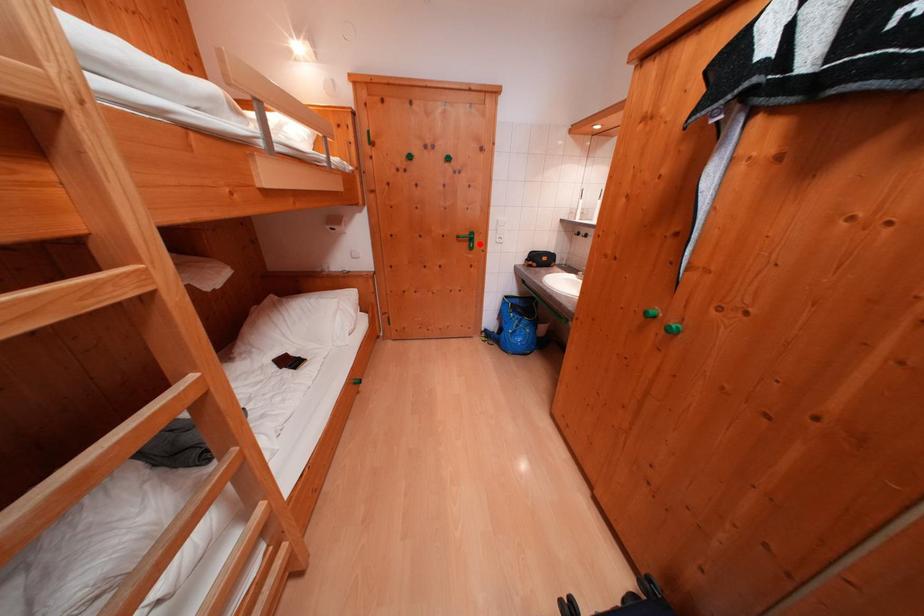
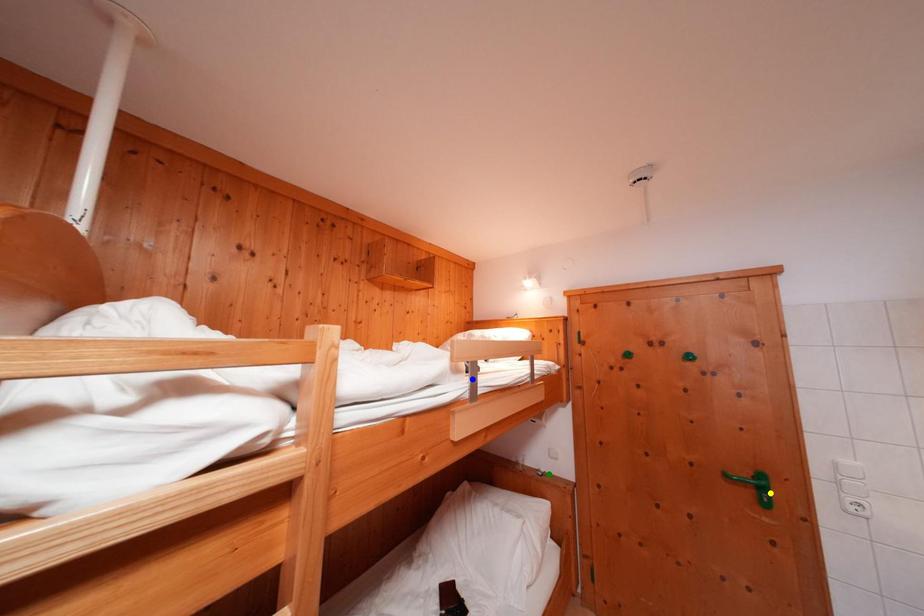
Question: I am providing you with two images of the same scene from different viewpoints. A red point is marked on the first image. You are given multiple points on the second image. In image 2, which mark is for the same physical point as the one in image 1?

Choices:
 (A) blue point
 (B) green point
 (C) yellow point

Answer: (C)